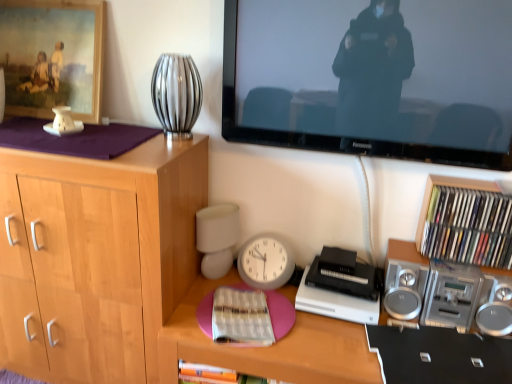
Question: Can you see white paper book at center, which is the first book from left to right, touching pink matte desk at center?

Choices:
 (A) no
 (B) yes

Answer: (A)

Question: Can you confirm if white paper book at center, placed as the second book when sorted from right to left, is thinner than pink matte desk at center?

Choices:
 (A) yes
 (B) no

Answer: (A)

Question: Is the depth of white paper book at center, placed as the second book when sorted from right to left, greater than that of pink matte desk at center?

Choices:
 (A) no
 (B) yes

Answer: (B)

Question: From a real-world perspective, is white paper book at center, acting as the 1th book starting from the bottom, physically above pink matte desk at center?

Choices:
 (A) no
 (B) yes

Answer: (B)

Question: Considering the relative positions of white paper book at center, acting as the 1th book starting from the bottom, and pink matte desk at center in the image provided, is white paper book at center, acting as the 1th book starting from the bottom, to the left of pink matte desk at center from the viewer's perspective?

Choices:
 (A) yes
 (B) no

Answer: (A)

Question: In terms of size, does black plastic printer at center appear bigger or smaller than multicolored paper book at right, which is the 2th book from left to right?

Choices:
 (A) big
 (B) small

Answer: (B)

Question: Would you say black plastic printer at center is inside or outside multicolored paper book at right, which is the 1th book in right-to-left order?

Choices:
 (A) outside
 (B) inside

Answer: (A)

Question: In the image, is black plastic printer at center positioned in front of or behind multicolored paper book at right, arranged as the 2th book when ordered from the bottom?

Choices:
 (A) behind
 (B) front

Answer: (A)

Question: From a real-world perspective, is black plastic printer at center above or below multicolored paper book at right, which is the 2th book from left to right?

Choices:
 (A) above
 (B) below

Answer: (B)

Question: Does point (458, 238) appear closer or farther from the camera than point (438, 279)?

Choices:
 (A) closer
 (B) farther

Answer: (B)

Question: Looking at their shapes, would you say multicolored paper book at right, arranged as the 2th book when ordered from the bottom, is wider or thinner than silver metallic stereo at right?

Choices:
 (A) wide
 (B) thin

Answer: (B)

Question: From their relative heights in the image, would you say multicolored paper book at right, which is the 1th book in right-to-left order, is taller or shorter than silver metallic stereo at right?

Choices:
 (A) short
 (B) tall

Answer: (A)

Question: Based on their sizes in the image, would you say multicolored paper book at right, arranged as the 2th book when ordered from the bottom, is bigger or smaller than silver metallic stereo at right?

Choices:
 (A) big
 (B) small

Answer: (B)

Question: Is wooden framed painting at upper left bigger or smaller than white paper book at center, acting as the 1th book starting from the bottom?

Choices:
 (A) big
 (B) small

Answer: (A)

Question: Based on their positions, is wooden framed painting at upper left located to the left or right of white paper book at center, which is the first book from left to right?

Choices:
 (A) right
 (B) left

Answer: (B)